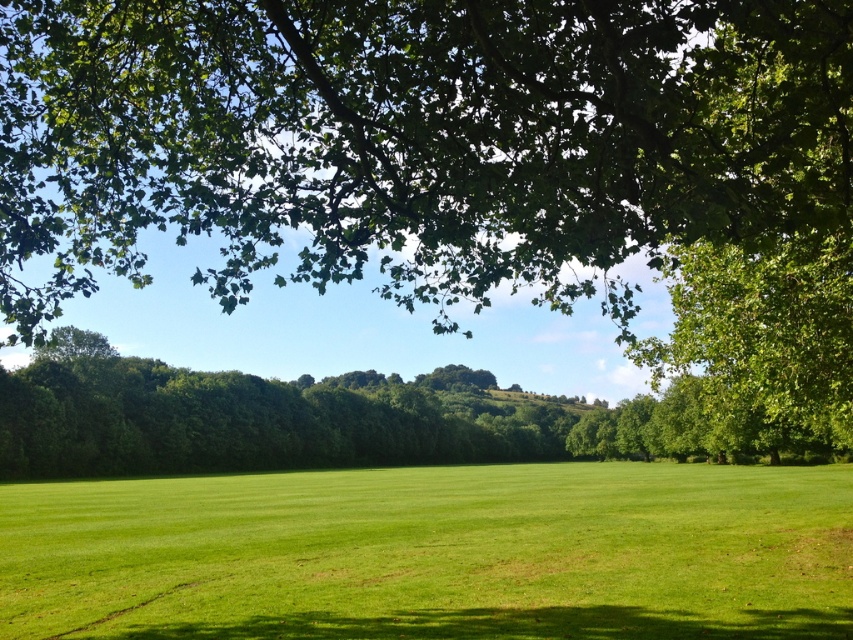
You are standing at the origin point of the coordinate system. You want to walk to the green grass at center. Which direction should you move in terms of x and y coordinates?

You should move towards the positive x and positive y directions since the green grass at center is located at point (434,554).